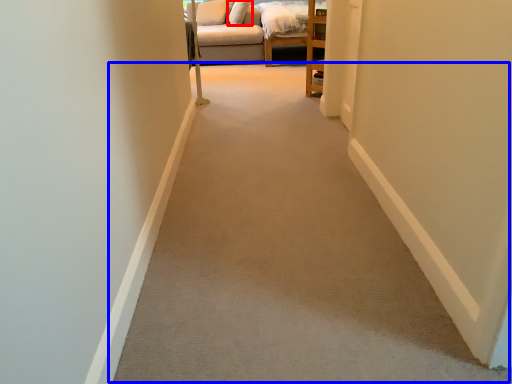
Question: Which object appears farthest to the camera in this image, pillow (highlighted by a red box) or path (highlighted by a blue box)?

Choices:
 (A) pillow
 (B) path

Answer: (A)